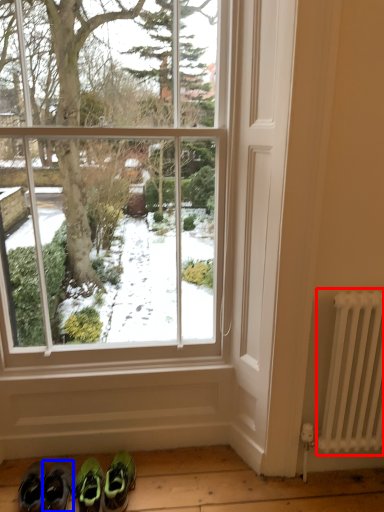
Question: Which object appears closest to the camera in this image, radiator (highlighted by a red box) or footwear (highlighted by a blue box)?

Choices:
 (A) radiator
 (B) footwear

Answer: (A)